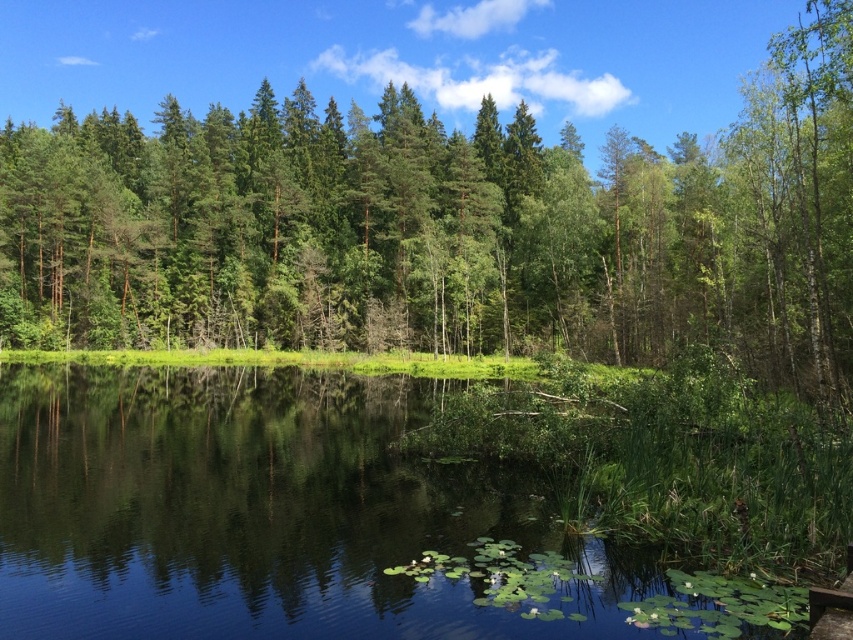
You are standing at the edge of the water in the serene natural landscape. There is a point marked at coordinates (445, 228). What object does this point indicate?

The point at coordinates (445, 228) marks a green leafy tree at the center of the scene.

You are standing in the landscape and want to walk towards the green leafy vegetation at lower center. Will you pass by the green leafy tree at center first?

Yes, you will pass by the green leafy tree at center first because it is closer to you than the green leafy vegetation at lower center.